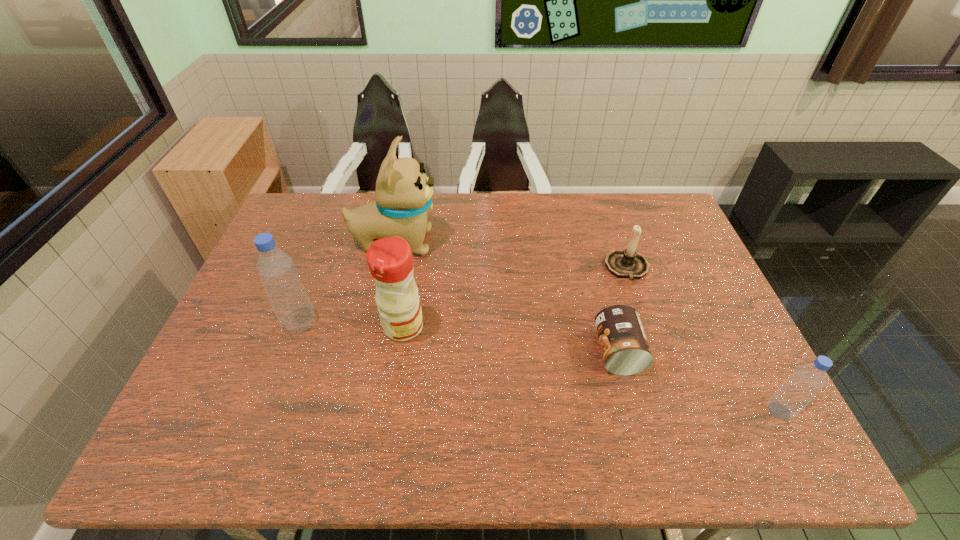
Where is `free space that satisfies the following two spatial constraints: 1. on the front side of the condiment; 2. on the left side of the shorter bottle`? free space that satisfies the following two spatial constraints: 1. on the front side of the condiment; 2. on the left side of the shorter bottle is located at coordinates (390, 411).

You are a GUI agent. You are given a task and a screenshot of the screen. Output one action in this format:
    pyautogui.click(x=<x>, y=<y>)
    Task: Click on the blank space that satisfies the following two spatial constraints: 1. on the face of the candle holder; 2. on the right side of the puppy
    
    Given the screenshot: What is the action you would take?
    pyautogui.click(x=389, y=268)

Where is `vacant area in the image that satisfies the following two spatial constraints: 1. on the face of the puppy; 2. on the left side of the nearer bottle`? Image resolution: width=960 pixels, height=540 pixels. vacant area in the image that satisfies the following two spatial constraints: 1. on the face of the puppy; 2. on the left side of the nearer bottle is located at coordinates (359, 411).